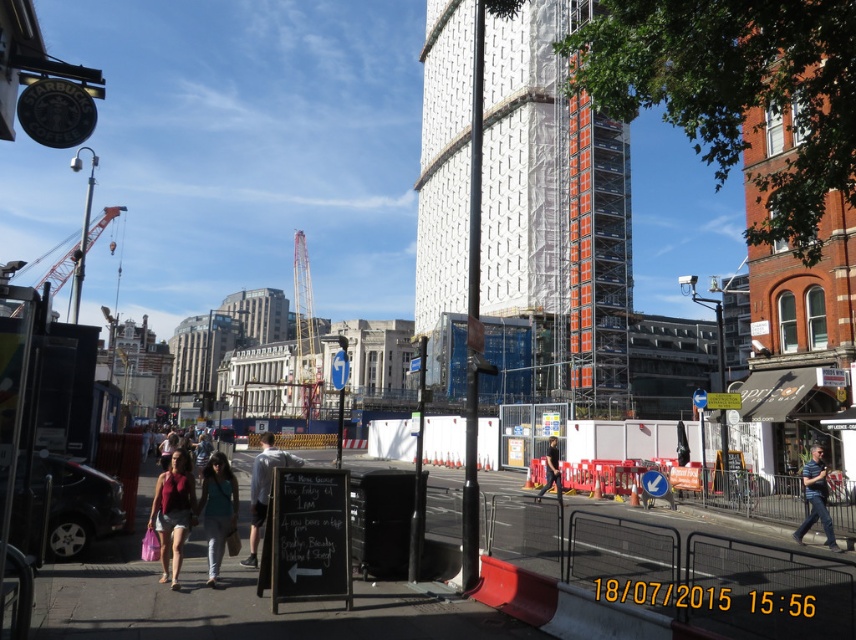
What do you see at coordinates (556, 209) in the screenshot? The image size is (856, 640). I see `white textured building at center` at bounding box center [556, 209].

Does white textured building at center have a lesser width compared to metallic scaffolding at center?

Yes, white textured building at center is thinner than metallic scaffolding at center.

Is point (611, 205) closer to camera compared to point (298, 284)?

Yes.

Locate an element on the screen. This screenshot has width=856, height=640. white textured building at center is located at coordinates (556, 209).

Is point (296, 456) more distant than point (61, 285)?

No, (296, 456) is closer to viewer.

Which of these two, light blue shirt at center or orange metallic crane at left, stands taller?

orange metallic crane at left is taller.

Who is more distant from viewer, (x=265, y=465) or (x=110, y=218)?

The point (x=110, y=218) is more distant.

You are a GUI agent. You are given a task and a screenshot of the screen. Output one action in this format:
    pyautogui.click(x=<x>, y=<y>)
    Task: Click on the light blue shirt at center
    This screenshot has height=640, width=856.
    Given the screenshot: What is the action you would take?
    coord(263,486)

Is denim pants at center below striped cotton shirt at center?

No, denim pants at center is not below striped cotton shirt at center.

The width and height of the screenshot is (856, 640). What are the coordinates of `denim pants at center` in the screenshot? It's located at pos(217,509).

The image size is (856, 640). Find the location of `denim pants at center`. denim pants at center is located at coordinates (217, 509).